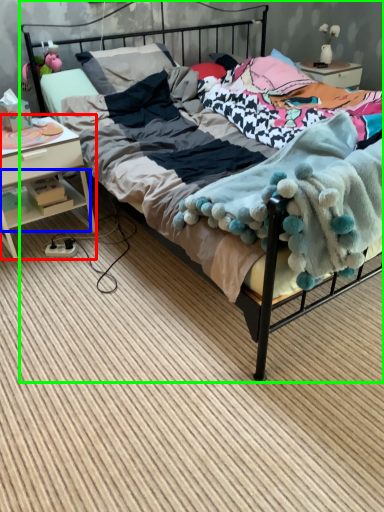
Question: Which object is the closest to the nightstand (highlighted by a red box)? Choose among these: shelf (highlighted by a blue box) or bed (highlighted by a green box).

Choices:
 (A) shelf
 (B) bed

Answer: (A)